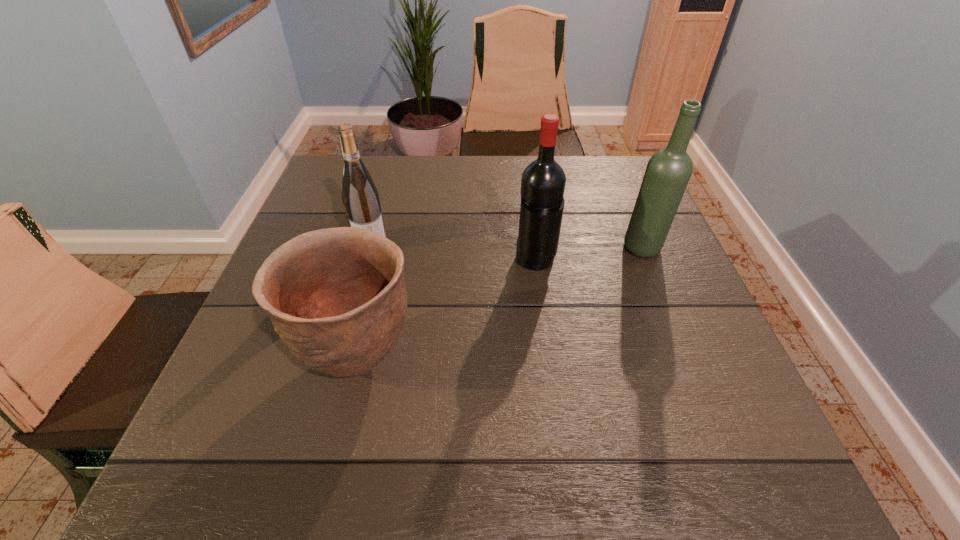
Image resolution: width=960 pixels, height=540 pixels. I want to click on wine bottle present at the left edge, so [360, 196].

The width and height of the screenshot is (960, 540). Find the location of `pottery present at the left edge`. pottery present at the left edge is located at coordinates (337, 298).

Where is `object at the right edge`? The image size is (960, 540). object at the right edge is located at coordinates (668, 171).

You are a GUI agent. You are given a task and a screenshot of the screen. Output one action in this format:
    pyautogui.click(x=<x>, y=<y>)
    Task: Click on the free space at the far edge of the desktop
    This screenshot has width=960, height=540.
    Given the screenshot: What is the action you would take?
    (x=496, y=200)

In the image, there is a desktop. Where is `free space at the near edge`? The image size is (960, 540). free space at the near edge is located at coordinates pyautogui.click(x=424, y=455).

Where is `vacant space at the left edge`? The height and width of the screenshot is (540, 960). vacant space at the left edge is located at coordinates (262, 348).

This screenshot has height=540, width=960. In the image, there is a desktop. Identify the location of free space at the right edge. (727, 376).

You are a GUI agent. You are given a task and a screenshot of the screen. Output one action in this format:
    pyautogui.click(x=<x>, y=<y>)
    Task: Click on the free space at the far right corner of the desktop
    
    Given the screenshot: What is the action you would take?
    pyautogui.click(x=639, y=176)

Locate an element on the screen. free space between the rightmost object and the second wine bottle from right to left is located at coordinates (588, 255).

Find the location of `free space between the leftmost wine bottle and the second object from right to left`. free space between the leftmost wine bottle and the second object from right to left is located at coordinates (453, 253).